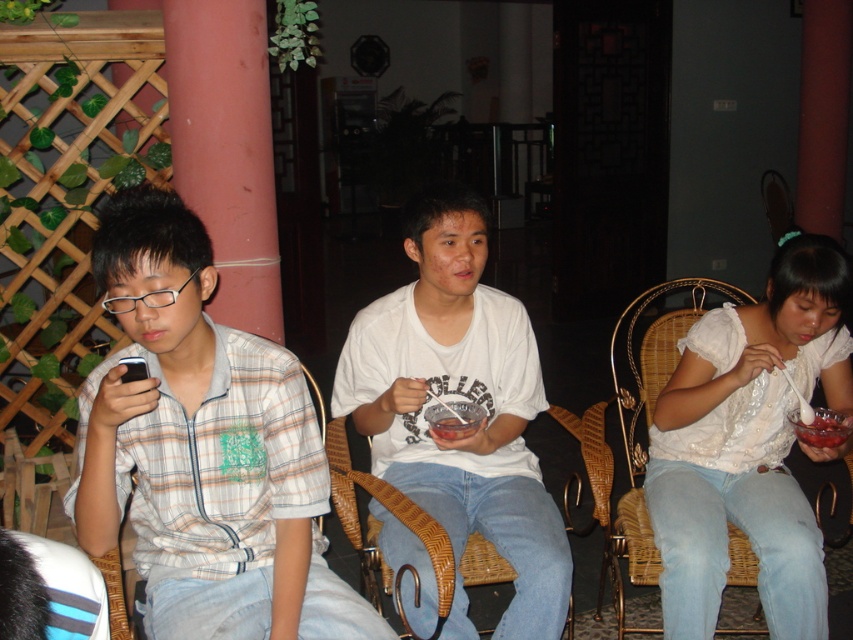
Which of these two, plaid shirt at left or woven rattan chair at lower left, stands taller?

Standing taller between the two is plaid shirt at left.

Can you confirm if plaid shirt at left is positioned below woven rattan chair at lower left?

Incorrect, plaid shirt at left is not positioned below woven rattan chair at lower left.

Describe the element at coordinates (202, 449) in the screenshot. Image resolution: width=853 pixels, height=640 pixels. I see `plaid shirt at left` at that location.

Find the location of `plaid shirt at left`. plaid shirt at left is located at coordinates (202, 449).

Which is behind, point (694, 292) or point (114, 636)?

Positioned behind is point (694, 292).

Who is more forward, (x=752, y=570) or (x=10, y=560)?

Point (x=10, y=560) is in front.

Locate an element on the screen. The image size is (853, 640). woven wicker chair at right is located at coordinates (703, 481).

Is woven rattan chair at lower left to the right of woven wicker chair at center from the viewer's perspective?

Incorrect, woven rattan chair at lower left is not on the right side of woven wicker chair at center.

Is woven rattan chair at lower left thinner than woven wicker chair at center?

Yes, woven rattan chair at lower left is thinner than woven wicker chair at center.

Is point (7, 577) positioned behind point (334, 433)?

No, it is in front of (334, 433).

Identify the location of woven rattan chair at lower left. (62, 589).